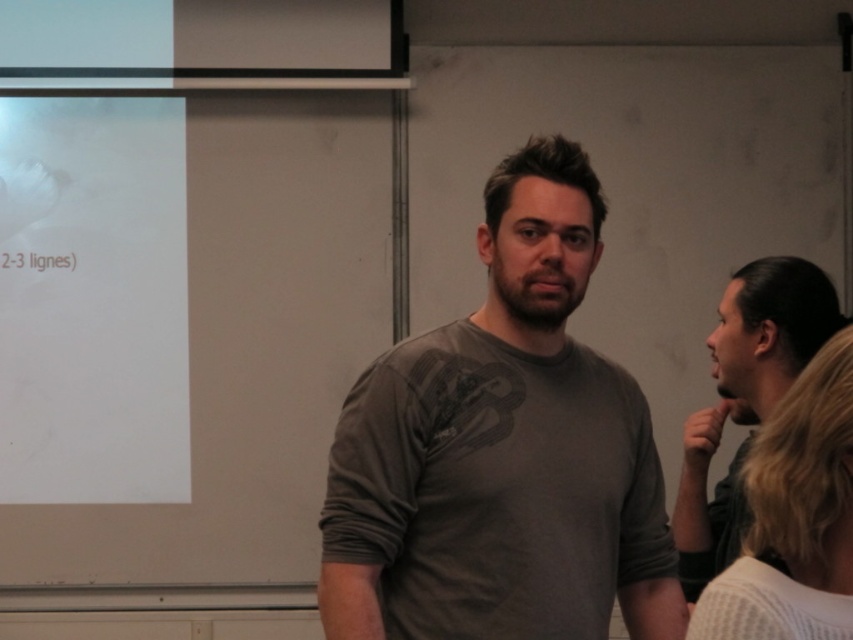
Does gray matte t-shirt at center appear on the right side of white knitted sweater at right?

Incorrect, gray matte t-shirt at center is not on the right side of white knitted sweater at right.

Does gray matte t-shirt at center have a larger size compared to white knitted sweater at right?

Yes.

Does point (318, 577) come in front of point (787, 500)?

No, (318, 577) is further to viewer.

Where is `gray matte t-shirt at center`? gray matte t-shirt at center is located at coordinates (502, 451).

Which of these two, gray matte t-shirt at center or white paper at upper left, stands taller?

With more height is white paper at upper left.

Does gray matte t-shirt at center lie in front of white paper at upper left?

Yes.

Is point (419, 580) less distant than point (157, 307)?

Yes, point (419, 580) is closer to viewer.

The image size is (853, 640). Identify the location of gray matte t-shirt at center. (502, 451).

Which is in front, point (96, 371) or point (786, 458)?

Point (786, 458) is more forward.

Between white paper at upper left and white knitted sweater at right, which one has less height?

white knitted sweater at right is shorter.

What do you see at coordinates (91, 300) in the screenshot?
I see `white paper at upper left` at bounding box center [91, 300].

This screenshot has height=640, width=853. In order to click on white paper at upper left in this screenshot , I will do `click(91, 300)`.